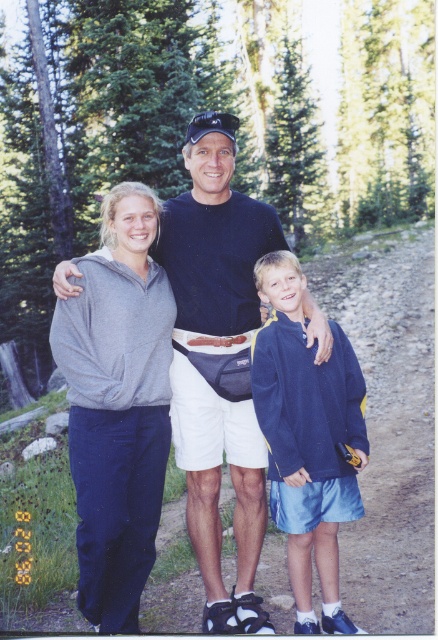
Question: Which point is closer to the camera?

Choices:
 (A) gray fleece sweatshirt at left
 (B) black cotton shirt at center
 (C) navy blue fleece at center

Answer: (C)

Question: Which of the following is the closest to the observer?

Choices:
 (A) (123, 369)
 (B) (195, 147)

Answer: (A)

Question: Which is farther from the gray fleece sweatshirt at left?

Choices:
 (A) navy blue fleece at center
 (B) black cotton shirt at center

Answer: (A)

Question: Can you confirm if gray fleece sweatshirt at left is thinner than black cotton shirt at center?

Choices:
 (A) yes
 (B) no

Answer: (A)

Question: From the image, what is the correct spatial relationship of black cotton shirt at center in relation to navy blue fleece at center?

Choices:
 (A) left
 (B) right

Answer: (A)

Question: Does gray fleece sweatshirt at left come behind black cotton shirt at center?

Choices:
 (A) yes
 (B) no

Answer: (B)